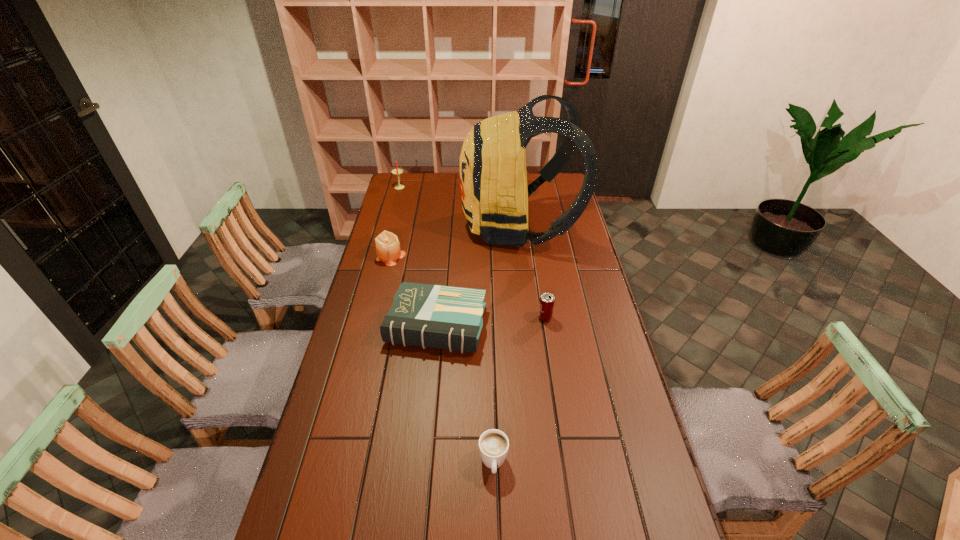
Where is `vacant position located 0.390m on the front of the farthest object`? Image resolution: width=960 pixels, height=540 pixels. vacant position located 0.390m on the front of the farthest object is located at coordinates (387, 234).

Image resolution: width=960 pixels, height=540 pixels. In order to click on free location located 0.070m on the right of the nearer candle in this screenshot , I will do `click(422, 256)`.

Identify the location of free space located 0.070m on the front of the beer can. (548, 339).

The width and height of the screenshot is (960, 540). In order to click on vacant area situated on the back of the paperback book in this screenshot , I will do `click(444, 248)`.

I want to click on object that is at the far edge, so click(x=396, y=171).

This screenshot has width=960, height=540. I want to click on paperback book that is at the left edge, so click(444, 317).

The width and height of the screenshot is (960, 540). Find the location of `object that is at the right edge`. object that is at the right edge is located at coordinates (493, 177).

Find the location of a particular element. The height and width of the screenshot is (540, 960). object at the far left corner is located at coordinates (396, 171).

The image size is (960, 540). Identify the location of vacant space at the far edge. (424, 181).

Locate an element on the screen. This screenshot has height=540, width=960. vacant space at the left edge of the desktop is located at coordinates (382, 313).